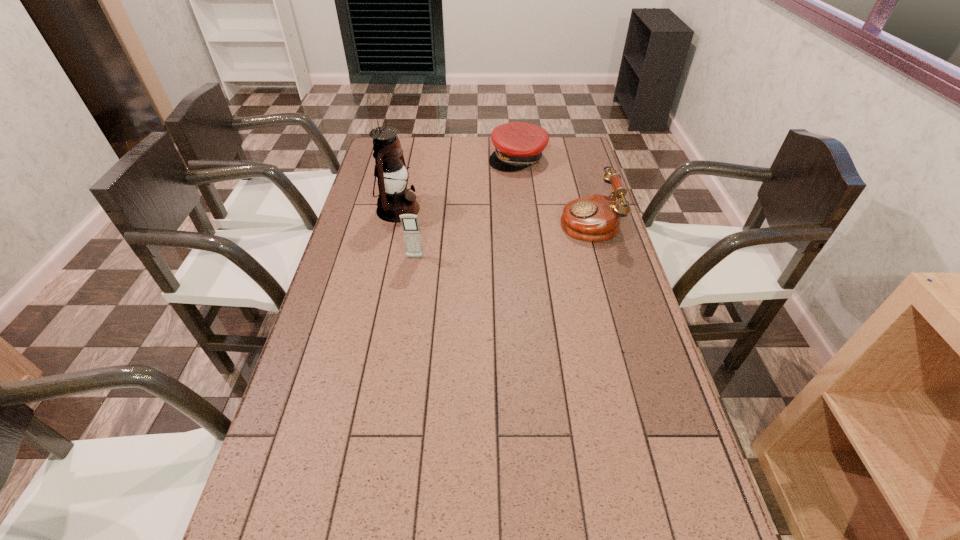
In the image, there is a desktop. In order to click on vacant space at the left edge in this screenshot , I will do `click(335, 408)`.

In the image, there is a desktop. Identify the location of vacant space at the right edge. (677, 414).

Identify the location of free space at the near left corner. Image resolution: width=960 pixels, height=540 pixels. (303, 506).

In the image, there is a desktop. Where is `vacant space at the far right corner`? The height and width of the screenshot is (540, 960). vacant space at the far right corner is located at coordinates (565, 164).

The width and height of the screenshot is (960, 540). I want to click on free space between the farthest object and the rightmost object, so click(x=553, y=189).

Identify the location of free space between the cap and the tallest object. (458, 184).

The width and height of the screenshot is (960, 540). I want to click on free area in between the rightmost object and the tallest object, so click(493, 215).

This screenshot has width=960, height=540. What are the coordinates of `blank region between the cellular telephone and the rightmost object` in the screenshot? It's located at tap(501, 239).

The height and width of the screenshot is (540, 960). What are the coordinates of `empty space that is in between the third object from left to right and the cellular telephone` in the screenshot? It's located at (467, 208).

This screenshot has height=540, width=960. Identify the location of free space that is in between the nearest object and the cap. (467, 208).